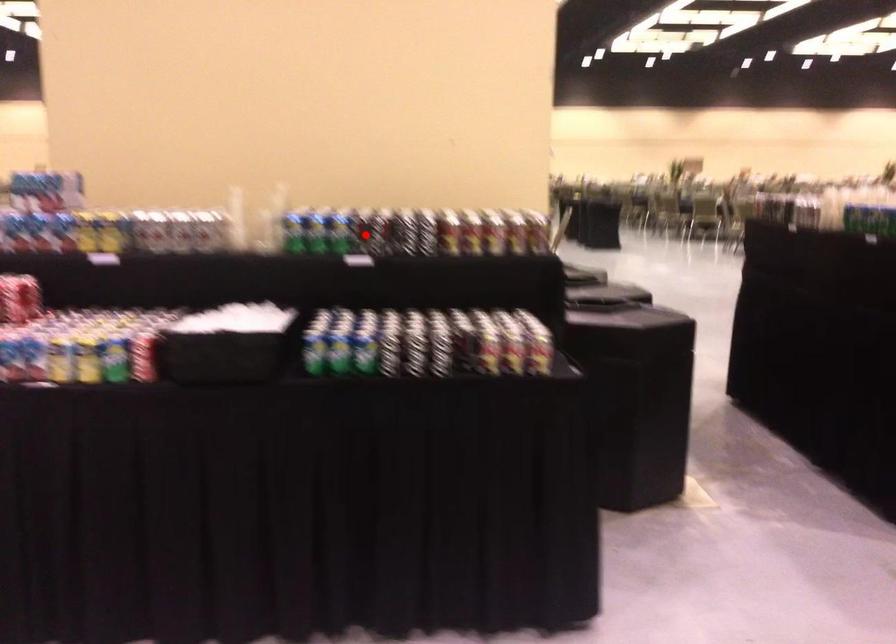
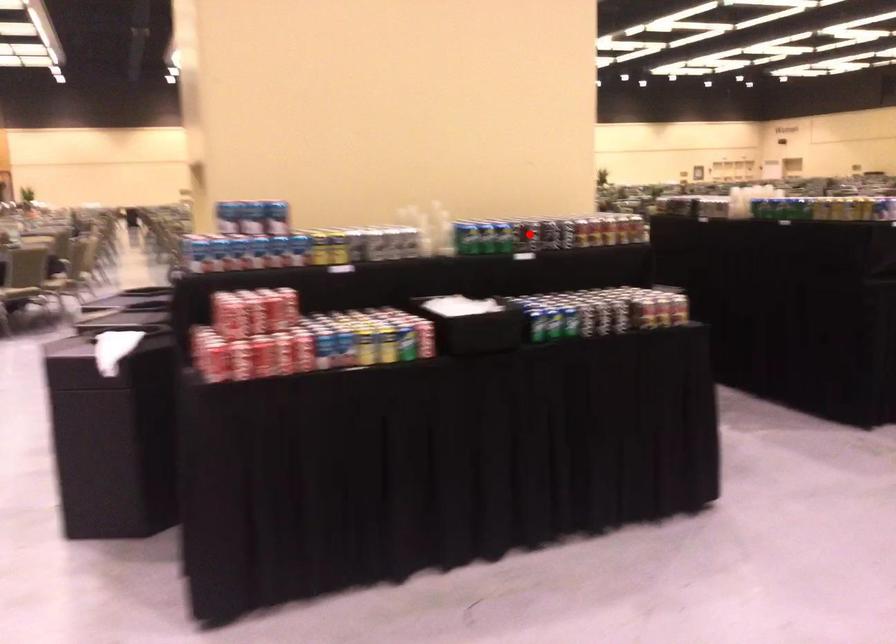
I am providing you with two images of the same scene from different viewpoints. A red point is marked on the first image and another point is marked on the second image. Do the highlighted points in image1 and image2 indicate the same real-world spot?

Yes